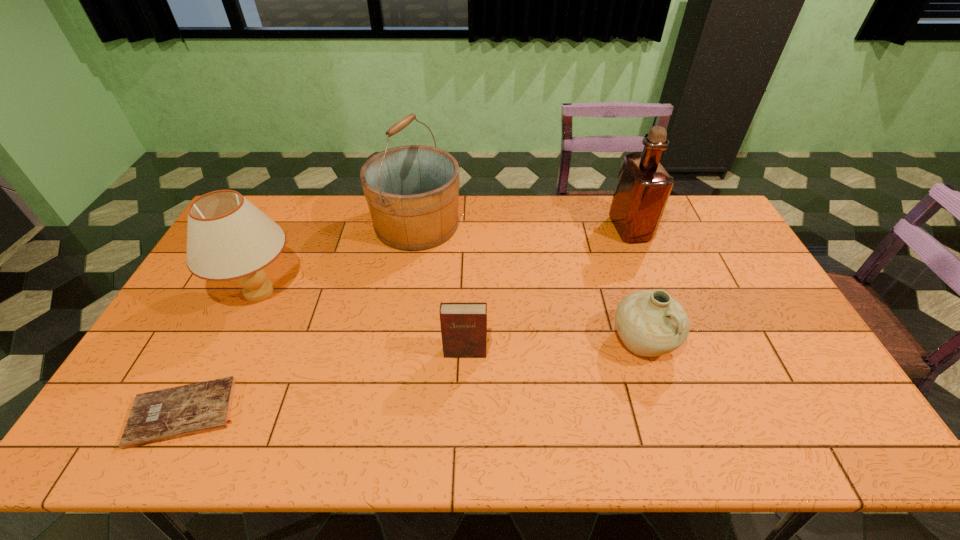
Locate an element on the screen. This screenshot has height=540, width=960. bucket is located at coordinates (412, 191).

Identify the location of liquor. This screenshot has height=540, width=960. (643, 186).

The image size is (960, 540). Find the location of `lampshade`. lampshade is located at coordinates (228, 238).

Where is `pottery`? pottery is located at coordinates (650, 323).

Where is `diary`? Image resolution: width=960 pixels, height=540 pixels. diary is located at coordinates (463, 325).

Where is `Bible`? Bible is located at coordinates (162, 415).

Identify the location of the nearest object. The height and width of the screenshot is (540, 960). (162, 415).

At what (x,y) coordinates should I click in order to perform the action: click on vacant space located on the front of the bucket. Please return your answer as a coordinate pair (x, y). This screenshot has width=960, height=540. Looking at the image, I should click on (404, 299).

This screenshot has height=540, width=960. Identify the location of vacant space located 0.190m on the right of the liquor. (702, 228).

You are a GUI agent. You are given a task and a screenshot of the screen. Output one action in this format:
    pyautogui.click(x=<x>, y=<y>)
    Task: Click on the vacant space located 0.230m on the front of the lampshade
    
    Given the screenshot: What is the action you would take?
    pyautogui.click(x=208, y=398)